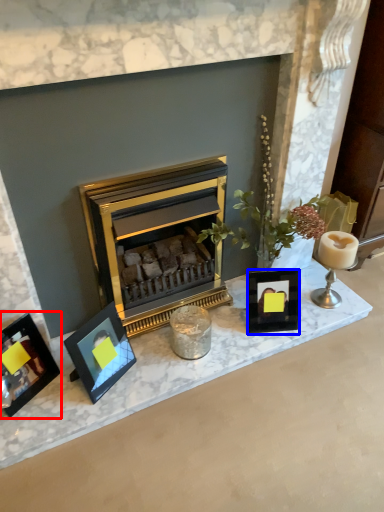
Question: Which object appears closest to the camera in this image, picture frame (highlighted by a red box) or picture frame (highlighted by a blue box)?

Choices:
 (A) picture frame
 (B) picture frame

Answer: (A)